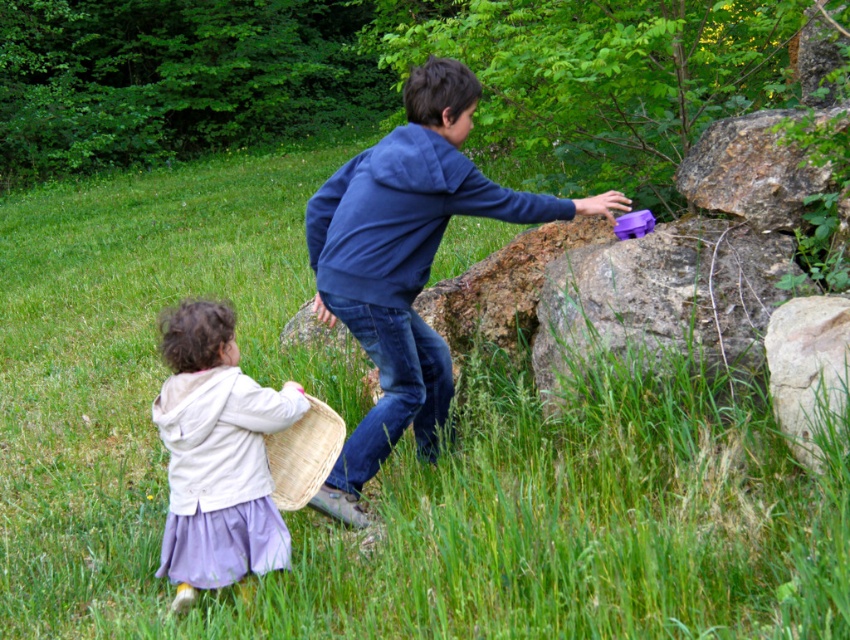
Question: Can you confirm if rusty stone boulder at upper right is thinner than brown woven basket at lower left?

Choices:
 (A) no
 (B) yes

Answer: (A)

Question: Which is farther from the blue cotton hoodie at center?

Choices:
 (A) brown woven basket at lower left
 (B) light purple fabric skirt at lower left
 (C) rough stone boulder at center right

Answer: (C)

Question: Which object is farther from the camera taking this photo?

Choices:
 (A) rusty stone boulder at upper right
 (B) brown woven basket at lower left
 (C) smooth gray rock at lower right

Answer: (A)

Question: Considering the real-world distances, which object is farthest from the brown woven basket at lower left?

Choices:
 (A) light purple fabric skirt at lower left
 (B) rusty stone boulder at upper right

Answer: (B)

Question: From the image, what is the correct spatial relationship of blue cotton hoodie at center in relation to brown woven basket at lower left?

Choices:
 (A) below
 (B) above

Answer: (B)

Question: Does rusty stone boulder at upper right have a lesser width compared to smooth gray rock at lower right?

Choices:
 (A) no
 (B) yes

Answer: (A)